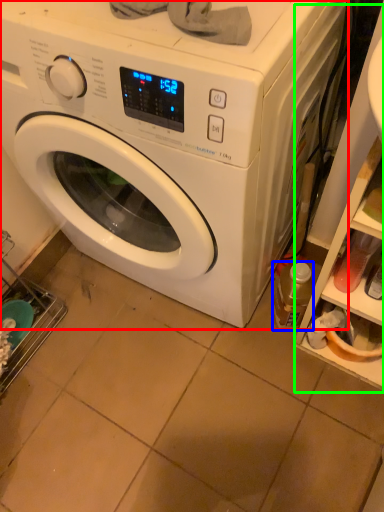
Question: Estimate the real-world distances between objects in this image. Which object is farther from washing machine (highlighted by a red box), bottle (highlighted by a blue box) or shelf (highlighted by a green box)?

Choices:
 (A) bottle
 (B) shelf

Answer: (A)